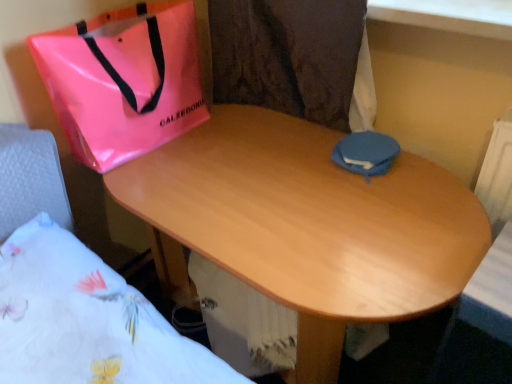
Locate an element on the screen. The height and width of the screenshot is (384, 512). blank area to the left of blue fabric pouch at center is located at coordinates (298, 158).